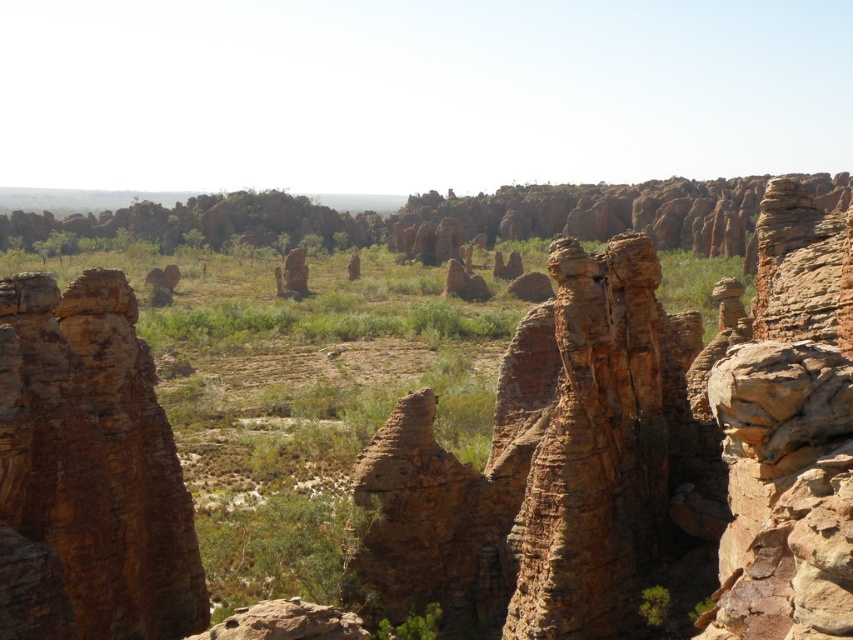
Question: Can you confirm if green leafy bush at center is bigger than green leafy shrub at lower center?

Choices:
 (A) yes
 (B) no

Answer: (A)

Question: Based on their relative distances, which object is nearer to the green leafy shrub at lower center?

Choices:
 (A) brown rough rock formation at center
 (B) green leafy bush at center

Answer: (A)

Question: Observing the image, what is the correct spatial positioning of green leafy bush at center in reference to green leafy shrub at lower center?

Choices:
 (A) right
 (B) left

Answer: (B)

Question: Does brown rough rock formation at center appear under green leafy shrub at lower center?

Choices:
 (A) no
 (B) yes

Answer: (A)

Question: Which is nearer to the brown rough rock formation at center?

Choices:
 (A) green leafy bush at center
 (B) green leafy shrub at lower center

Answer: (A)

Question: Which point appears farthest from the camera in this image?

Choices:
 (A) (416, 634)
 (B) (204, 545)
 (C) (85, 472)

Answer: (B)